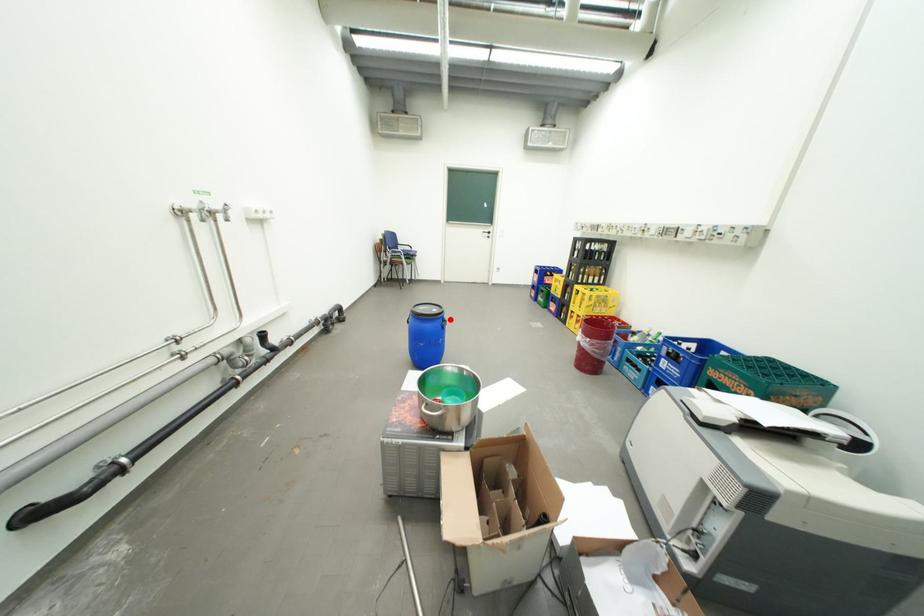
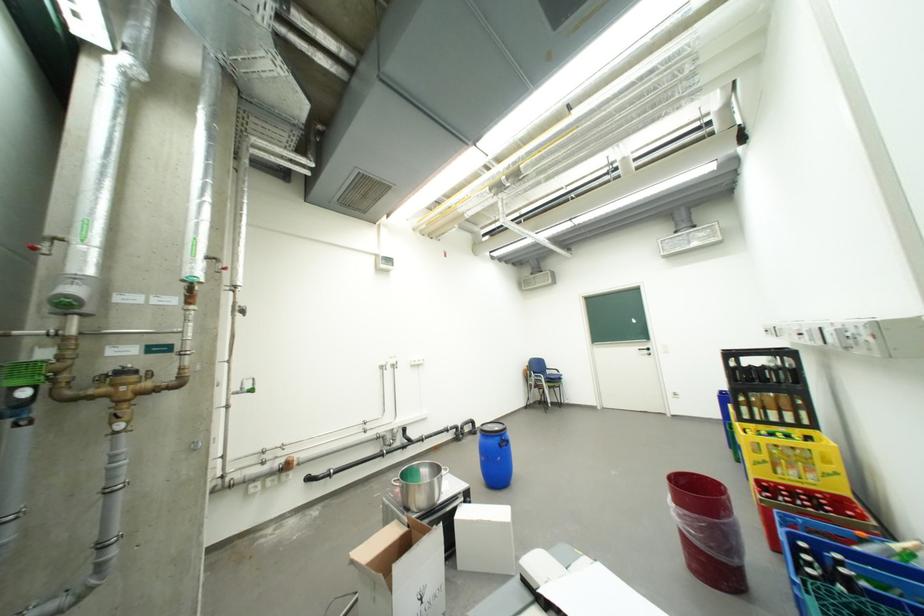
Question: A red point is marked in image1. In image2, is the corresponding 3D point closer to the camera or farther? Reply with the corresponding letter.

Choices:
 (A) The corresponding 3D point is closer.
 (B) The corresponding 3D point is farther.

Answer: (B)